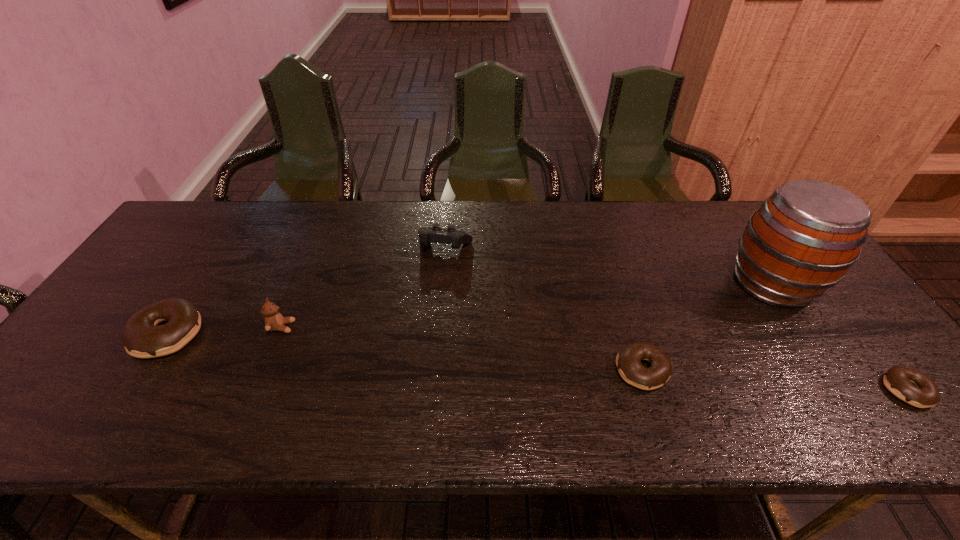
The width and height of the screenshot is (960, 540). In order to click on cider present at the right edge in this screenshot , I will do `click(803, 239)`.

Where is `object positioned at the near right corner`? object positioned at the near right corner is located at coordinates (909, 385).

Identify the location of free space at the far edge. (381, 202).

Find the location of `vacant point at the near edge`. vacant point at the near edge is located at coordinates (378, 392).

In the image, there is a desktop. Where is `vacant area at the left edge`? vacant area at the left edge is located at coordinates (133, 286).

I want to click on free space at the right edge, so click(811, 340).

In order to click on vacant area at the far left corner of the desktop in this screenshot , I will do `click(202, 216)`.

Where is `vacant area between the shortest object and the teddy bear`? This screenshot has width=960, height=540. vacant area between the shortest object and the teddy bear is located at coordinates (594, 359).

Locate an element on the screen. The width and height of the screenshot is (960, 540). empty location between the teddy bear and the shortest object is located at coordinates (594, 359).

Image resolution: width=960 pixels, height=540 pixels. What are the coordinates of `free space between the shortest doughnut and the third object from left to right` in the screenshot? It's located at (676, 319).